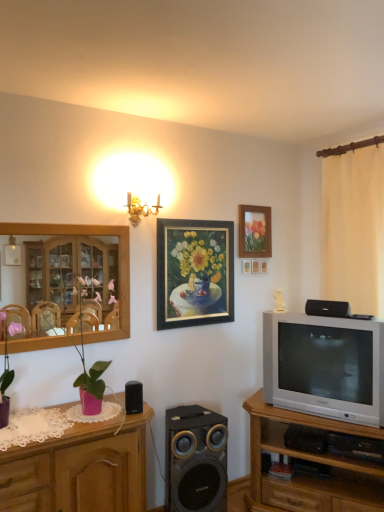
In order to click on free spot above pink wood cabinet at left, the second cabinetry positioned from the right (from a real-world perspective) in this screenshot , I will do `click(74, 417)`.